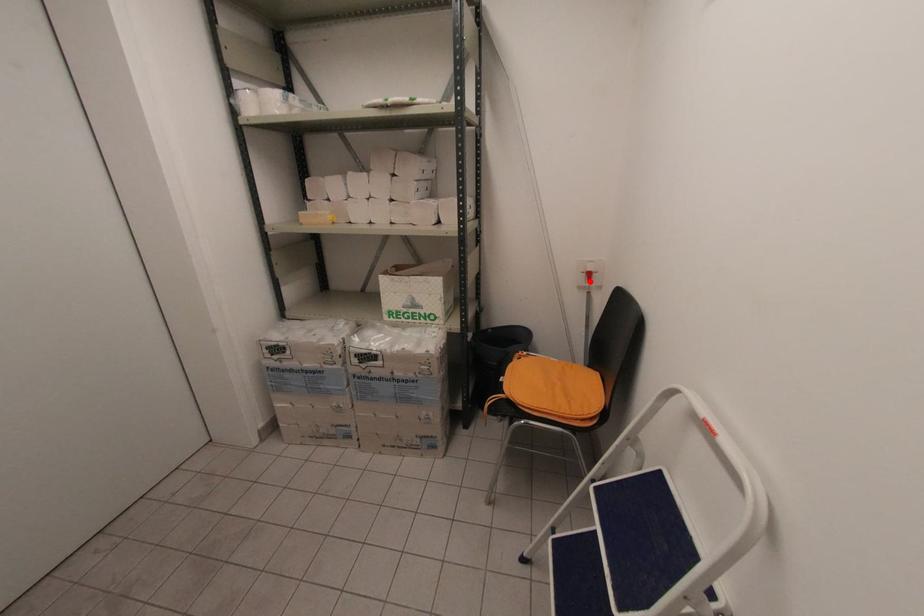
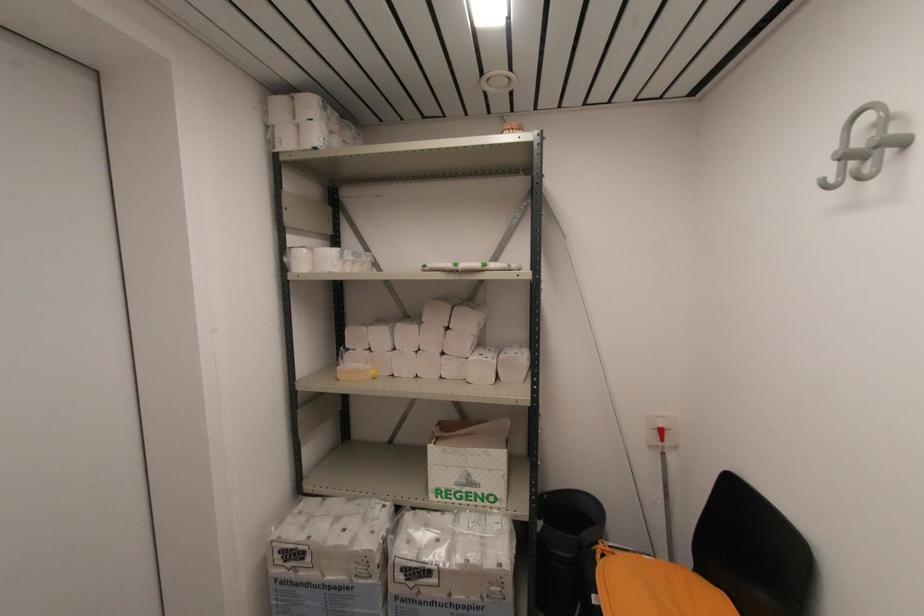
Question: I am providing you with two images of the same scene from different viewpoints. A red point is shown in image1. For the corresponding object point in image2, is it positioned nearer or farther from the camera?

Choices:
 (A) Nearer
 (B) Farther

Answer: (B)